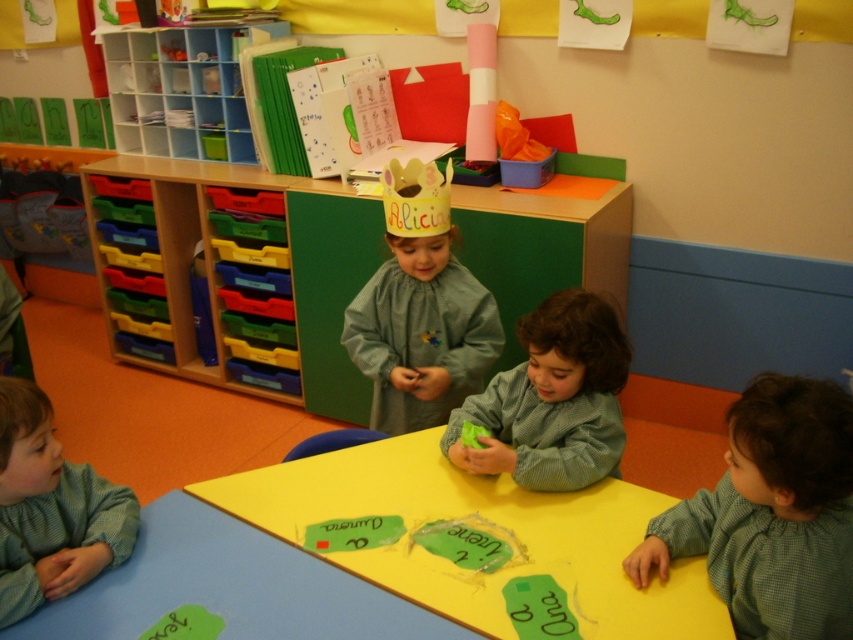
Question: Is matte gray dress at center wider than green knitted sweater at center?

Choices:
 (A) yes
 (B) no

Answer: (A)

Question: Is green checkered shirt at lower right smaller than green textured shirt at lower left?

Choices:
 (A) no
 (B) yes

Answer: (A)

Question: Is green knitted sweater at center smaller than green textured shirt at lower left?

Choices:
 (A) yes
 (B) no

Answer: (B)

Question: Which is nearer to the green knitted sweater at center?

Choices:
 (A) matte gray dress at center
 (B) green checkered shirt at lower right
 (C) green textured shirt at lower left
 (D) yellow matte table at center

Answer: (D)

Question: Estimate the real-world distances between objects in this image. Which object is farther from the matte gray dress at center?

Choices:
 (A) green checkered shirt at lower right
 (B) yellow matte table at center
 (C) green knitted sweater at center

Answer: (A)

Question: Which of these objects is positioned farthest from the green checkered shirt at lower right?

Choices:
 (A) green knitted sweater at center
 (B) matte gray dress at center

Answer: (B)